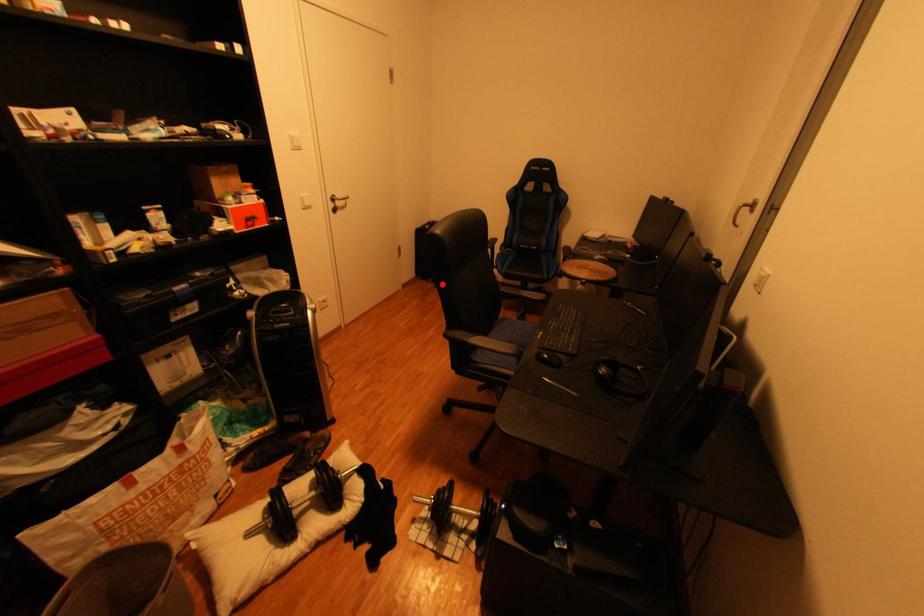
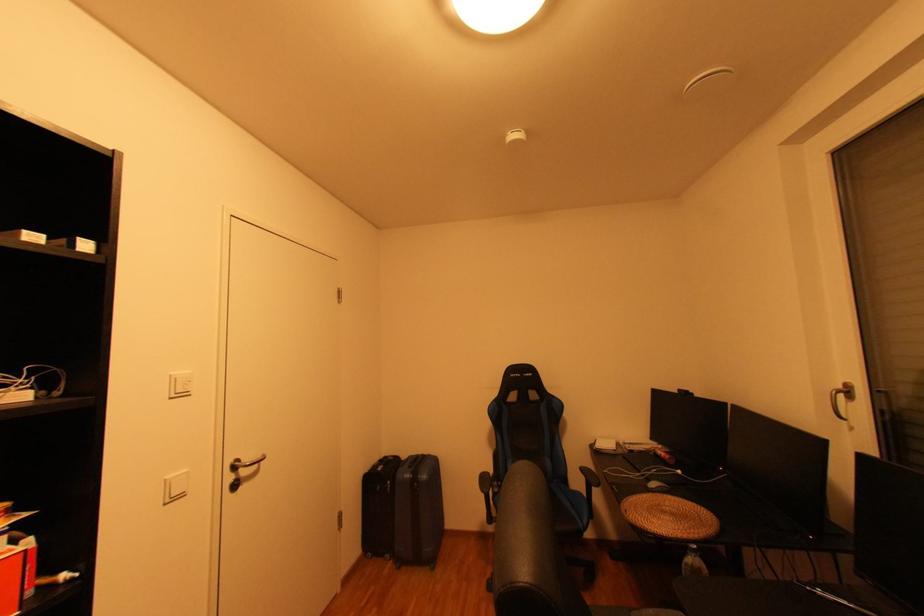
Question: I am providing you with two images of the same scene from different viewpoints. In image1, a red point is highlighted. Considering the same 3D point in image2, which of the following is correct?

Choices:
 (A) It is closer
 (B) It is farther

Answer: (A)